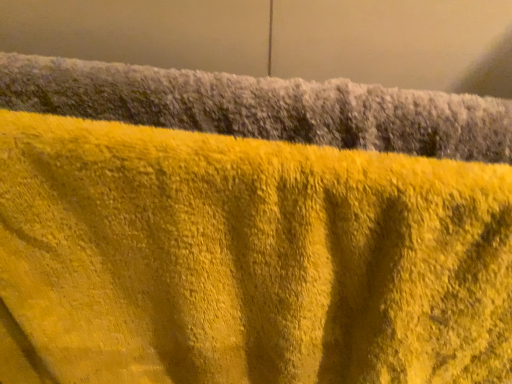
At what (x,y) coordinates should I click in order to perform the action: click on yellow fuzzy towel at upper center, which is counted as the 1th towel, starting from the top. Please return your answer as a coordinate pair (x, y). The width and height of the screenshot is (512, 384). Looking at the image, I should click on (264, 107).

What do you see at coordinates (264, 107) in the screenshot?
I see `yellow fuzzy towel at upper center, which is counted as the 1th towel, starting from the top` at bounding box center [264, 107].

What is the approximate width of yellow fuzzy towel at upper center, which is counted as the 1th towel, starting from the top?

It is 2.80 inches.

Image resolution: width=512 pixels, height=384 pixels. Describe the element at coordinates (246, 260) in the screenshot. I see `yellow fuzzy towel at upper center, which ranks as the first towel in bottom-to-top order` at that location.

Where is `yellow fuzzy towel at upper center, the second towel when ordered from top to bottom`? yellow fuzzy towel at upper center, the second towel when ordered from top to bottom is located at coordinates (246, 260).

What is the approximate height of yellow fuzzy towel at upper center, the second towel when ordered from top to bottom?

23.02 inches.

This screenshot has width=512, height=384. Identify the location of yellow fuzzy towel at upper center, the 2th towel in the bottom-to-top sequence. (x=264, y=107).

Consider the image. Which object is positioned more to the right, yellow fuzzy towel at upper center, which is counted as the 1th towel, starting from the top, or yellow fuzzy towel at upper center, which ranks as the first towel in bottom-to-top order?

Positioned to the right is yellow fuzzy towel at upper center, which is counted as the 1th towel, starting from the top.

Relative to yellow fuzzy towel at upper center, the second towel when ordered from top to bottom, is yellow fuzzy towel at upper center, which is counted as the 1th towel, starting from the top, in front or behind?

Visually, yellow fuzzy towel at upper center, which is counted as the 1th towel, starting from the top, is located behind yellow fuzzy towel at upper center, the second towel when ordered from top to bottom.

Is point (291, 80) more distant than point (11, 314)?

No, (291, 80) is in front of (11, 314).

From the image's perspective, relative to yellow fuzzy towel at upper center, the second towel when ordered from top to bottom, is yellow fuzzy towel at upper center, which is counted as the 1th towel, starting from the top, above or below?

yellow fuzzy towel at upper center, which is counted as the 1th towel, starting from the top, is above yellow fuzzy towel at upper center, the second towel when ordered from top to bottom.

From a real-world perspective, which is physically below, yellow fuzzy towel at upper center, which is counted as the 1th towel, starting from the top, or yellow fuzzy towel at upper center, the second towel when ordered from top to bottom?

yellow fuzzy towel at upper center, the second towel when ordered from top to bottom, is physically lower.

Considering the sizes of objects yellow fuzzy towel at upper center, the 2th towel in the bottom-to-top sequence, and yellow fuzzy towel at upper center, which ranks as the first towel in bottom-to-top order, in the image provided, who is thinner, yellow fuzzy towel at upper center, the 2th towel in the bottom-to-top sequence, or yellow fuzzy towel at upper center, which ranks as the first towel in bottom-to-top order,?

yellow fuzzy towel at upper center, the 2th towel in the bottom-to-top sequence.

Considering the sizes of objects yellow fuzzy towel at upper center, which is counted as the 1th towel, starting from the top, and yellow fuzzy towel at upper center, the second towel when ordered from top to bottom, in the image provided, who is taller, yellow fuzzy towel at upper center, which is counted as the 1th towel, starting from the top, or yellow fuzzy towel at upper center, the second towel when ordered from top to bottom,?

Standing taller between the two is yellow fuzzy towel at upper center, the second towel when ordered from top to bottom.

Does yellow fuzzy towel at upper center, which is counted as the 1th towel, starting from the top, have a smaller size compared to yellow fuzzy towel at upper center, which ranks as the first towel in bottom-to-top order?

Indeed, yellow fuzzy towel at upper center, which is counted as the 1th towel, starting from the top, has a smaller size compared to yellow fuzzy towel at upper center, which ranks as the first towel in bottom-to-top order.

From the picture: Is yellow fuzzy towel at upper center, the 2th towel in the bottom-to-top sequence, inside or outside of yellow fuzzy towel at upper center, the second towel when ordered from top to bottom?

yellow fuzzy towel at upper center, the 2th towel in the bottom-to-top sequence, is not enclosed by yellow fuzzy towel at upper center, the second towel when ordered from top to bottom.

Is yellow fuzzy towel at upper center, which is counted as the 1th towel, starting from the top, positioned far away from yellow fuzzy towel at upper center, the second towel when ordered from top to bottom?

No.

Is yellow fuzzy towel at upper center, the 2th towel in the bottom-to-top sequence, facing away from yellow fuzzy towel at upper center, which ranks as the first towel in bottom-to-top order?

No, yellow fuzzy towel at upper center, the 2th towel in the bottom-to-top sequence, is not facing the opposite direction of yellow fuzzy towel at upper center, which ranks as the first towel in bottom-to-top order.

The image size is (512, 384). In order to click on towel in front of the yellow fuzzy towel at upper center, the 2th towel in the bottom-to-top sequence in this screenshot , I will do `click(246, 260)`.

In the scene shown: Between yellow fuzzy towel at upper center, the second towel when ordered from top to bottom, and yellow fuzzy towel at upper center, which is counted as the 1th towel, starting from the top, which one appears on the right side from the viewer's perspective?

yellow fuzzy towel at upper center, which is counted as the 1th towel, starting from the top, is more to the right.

Does yellow fuzzy towel at upper center, which ranks as the first towel in bottom-to-top order, lie in front of yellow fuzzy towel at upper center, which is counted as the 1th towel, starting from the top?

Yes, the depth of yellow fuzzy towel at upper center, which ranks as the first towel in bottom-to-top order, is less than that of yellow fuzzy towel at upper center, which is counted as the 1th towel, starting from the top.

Which point is more distant from viewer, (449, 290) or (474, 136)?

The point (449, 290) is behind.

From the image's perspective, would you say yellow fuzzy towel at upper center, the second towel when ordered from top to bottom, is positioned over yellow fuzzy towel at upper center, the 2th towel in the bottom-to-top sequence?

Incorrect, from the image's perspective, yellow fuzzy towel at upper center, the second towel when ordered from top to bottom, is lower than yellow fuzzy towel at upper center, the 2th towel in the bottom-to-top sequence.

From a real-world perspective, relative to yellow fuzzy towel at upper center, which is counted as the 1th towel, starting from the top, is yellow fuzzy towel at upper center, the second towel when ordered from top to bottom, vertically above or below?

yellow fuzzy towel at upper center, the second towel when ordered from top to bottom, is below yellow fuzzy towel at upper center, which is counted as the 1th towel, starting from the top.

Consider the image. Can you confirm if yellow fuzzy towel at upper center, which ranks as the first towel in bottom-to-top order, is thinner than yellow fuzzy towel at upper center, the 2th towel in the bottom-to-top sequence?

No, yellow fuzzy towel at upper center, which ranks as the first towel in bottom-to-top order, is not thinner than yellow fuzzy towel at upper center, the 2th towel in the bottom-to-top sequence.

Considering the sizes of yellow fuzzy towel at upper center, which ranks as the first towel in bottom-to-top order, and yellow fuzzy towel at upper center, which is counted as the 1th towel, starting from the top, in the image, is yellow fuzzy towel at upper center, which ranks as the first towel in bottom-to-top order, taller or shorter than yellow fuzzy towel at upper center, which is counted as the 1th towel, starting from the top,?

In the image, yellow fuzzy towel at upper center, which ranks as the first towel in bottom-to-top order, appears to be taller than yellow fuzzy towel at upper center, which is counted as the 1th towel, starting from the top.

Who is smaller, yellow fuzzy towel at upper center, which ranks as the first towel in bottom-to-top order, or yellow fuzzy towel at upper center, the 2th towel in the bottom-to-top sequence?

yellow fuzzy towel at upper center, the 2th towel in the bottom-to-top sequence, is smaller.

Is yellow fuzzy towel at upper center, the second towel when ordered from top to bottom, completely or partially outside of yellow fuzzy towel at upper center, which is counted as the 1th towel, starting from the top?

Yes, yellow fuzzy towel at upper center, the second towel when ordered from top to bottom, is located beyond the bounds of yellow fuzzy towel at upper center, which is counted as the 1th towel, starting from the top.

Is yellow fuzzy towel at upper center, the second towel when ordered from top to bottom, positioned far away from yellow fuzzy towel at upper center, the 2th towel in the bottom-to-top sequence?

No, yellow fuzzy towel at upper center, the second towel when ordered from top to bottom, is not far away from yellow fuzzy towel at upper center, the 2th towel in the bottom-to-top sequence.

Is yellow fuzzy towel at upper center, which ranks as the first towel in bottom-to-top order, oriented towards yellow fuzzy towel at upper center, the 2th towel in the bottom-to-top sequence?

No, yellow fuzzy towel at upper center, which ranks as the first towel in bottom-to-top order, is not facing towards yellow fuzzy towel at upper center, the 2th towel in the bottom-to-top sequence.

How different are the orientations of yellow fuzzy towel at upper center, the second towel when ordered from top to bottom, and yellow fuzzy towel at upper center, the 2th towel in the bottom-to-top sequence, in degrees?

yellow fuzzy towel at upper center, the second towel when ordered from top to bottom, and yellow fuzzy towel at upper center, the 2th towel in the bottom-to-top sequence, are facing 0.00101 degrees away from each other.

Locate an element on the screen. The height and width of the screenshot is (384, 512). towel lying above the yellow fuzzy towel at upper center, the second towel when ordered from top to bottom (from the image's perspective) is located at coordinates (264, 107).

Locate an element on the screen. This screenshot has height=384, width=512. towel behind the yellow fuzzy towel at upper center, which ranks as the first towel in bottom-to-top order is located at coordinates (264, 107).

At what (x,y) coordinates should I click in order to perform the action: click on towel on the left side of yellow fuzzy towel at upper center, the 2th towel in the bottom-to-top sequence. Please return your answer as a coordinate pair (x, y). This screenshot has height=384, width=512. Looking at the image, I should click on (246, 260).